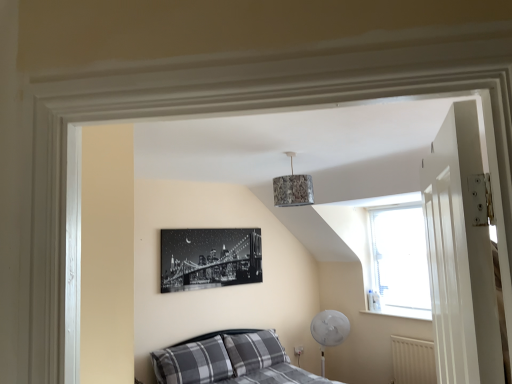
Question: Does plaid fabric pillow at lower left, which is counted as the first pillow, starting from the left, have a lesser height compared to transparent glass window at upper right?

Choices:
 (A) no
 (B) yes

Answer: (B)

Question: Does plaid fabric pillow at lower left, which is counted as the first pillow, starting from the left, have a lesser width compared to transparent glass window at upper right?

Choices:
 (A) yes
 (B) no

Answer: (B)

Question: Considering the relative positions of plaid fabric pillow at lower left, which is counted as the first pillow, starting from the left, and transparent glass window at upper right in the image provided, is plaid fabric pillow at lower left, which is counted as the first pillow, starting from the left, in front of transparent glass window at upper right?

Choices:
 (A) no
 (B) yes

Answer: (B)

Question: From a real-world perspective, is plaid fabric pillow at lower left, which is counted as the first pillow, starting from the left, on transparent glass window at upper right?

Choices:
 (A) yes
 (B) no

Answer: (B)

Question: Considering the relative positions of plaid fabric pillow at lower left, which is counted as the first pillow, starting from the left, and transparent glass window at upper right in the image provided, is plaid fabric pillow at lower left, which is counted as the first pillow, starting from the left, to the right of transparent glass window at upper right from the viewer's perspective?

Choices:
 (A) no
 (B) yes

Answer: (A)

Question: Would you say textured fabric lampshade at upper center is to the left or to the right of plaid fabric bed at lower left in the picture?

Choices:
 (A) left
 (B) right

Answer: (B)

Question: From a real-world perspective, is textured fabric lampshade at upper center positioned above or below plaid fabric bed at lower left?

Choices:
 (A) below
 (B) above

Answer: (B)

Question: Is textured fabric lampshade at upper center in front of or behind plaid fabric bed at lower left in the image?

Choices:
 (A) front
 (B) behind

Answer: (B)

Question: Is textured fabric lampshade at upper center situated inside plaid fabric bed at lower left or outside?

Choices:
 (A) outside
 (B) inside

Answer: (A)

Question: Is transparent glass window at upper right in front of or behind gray plaid pillow at lower center, the first pillow viewed from the right, in the image?

Choices:
 (A) front
 (B) behind

Answer: (B)

Question: Is transparent glass window at upper right to the left or to the right of gray plaid pillow at lower center, the first pillow viewed from the right, in the image?

Choices:
 (A) left
 (B) right

Answer: (B)

Question: From a real-world perspective, is transparent glass window at upper right physically located above or below gray plaid pillow at lower center, the first pillow viewed from the right?

Choices:
 (A) below
 (B) above

Answer: (B)

Question: From their relative heights in the image, would you say transparent glass window at upper right is taller or shorter than gray plaid pillow at lower center, which is the second pillow in left-to-right order?

Choices:
 (A) tall
 (B) short

Answer: (A)

Question: Looking at their shapes, would you say plaid fabric pillow at lower left, positioned as the 2th pillow in right-to-left order, is wider or thinner than white textured radiator at lower right?

Choices:
 (A) wide
 (B) thin

Answer: (A)

Question: Which is correct: plaid fabric pillow at lower left, which is counted as the first pillow, starting from the left, is inside white textured radiator at lower right, or outside of it?

Choices:
 (A) inside
 (B) outside

Answer: (B)